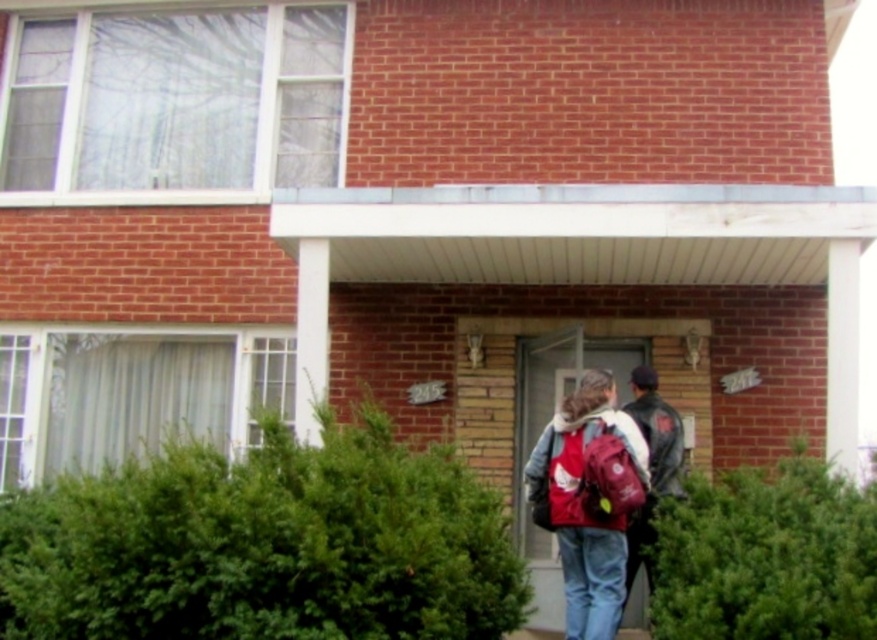
You are standing at the entrance of the building and want to place a decorative pot exactly 2 meters away from the green leafy hedge at center. Considering the hedge is located at coordinates point 0.852, 0.303, where should the pot be placed?

The pot should be placed 2 meters away from the green leafy hedge at center, but the exact coordinates depend on the direction chosen from the hedge.

You are a gardener planning to trim both the green leafy hedge at center and the green leafy hedge at lower right. Based on their sizes, which hedge will require more time and effort to maintain?

The green leafy hedge at center will require more time and effort to maintain because it is larger in size than the green leafy hedge at lower right.

You are standing at the entrance of the two story brick building and want to water the green leafy hedge at center. If your watering can has a maximum reach of 5 meters, will you be able to water it without moving closer?

The green leafy hedge at center is 5.22 meters away from camera, which is beyond the watering can reach of 5 meters. You need to move closer to water it.